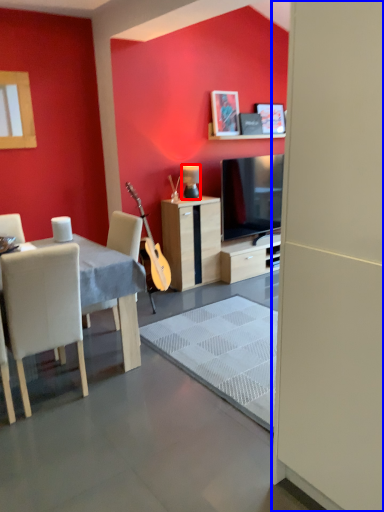
Question: Which object is closer to the camera taking this photo, lamp (highlighted by a red box) or screen door (highlighted by a blue box)?

Choices:
 (A) lamp
 (B) screen door

Answer: (B)